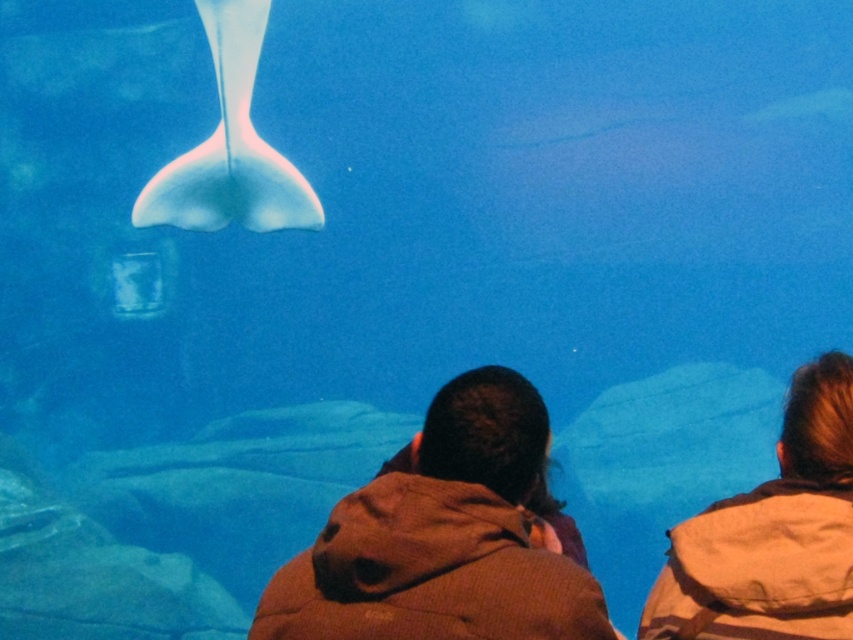
Who is more forward, (x=704, y=566) or (x=309, y=218)?

Positioned in front is point (x=704, y=566).

Can you confirm if brown textured jacket at upper right is positioned to the left of translucent white stingray at upper center?

Incorrect, brown textured jacket at upper right is not on the left side of translucent white stingray at upper center.

Find the location of a particular element. This screenshot has height=640, width=853. brown textured jacket at upper right is located at coordinates (772, 534).

Find the location of `brown textured jacket at upper right`. brown textured jacket at upper right is located at coordinates (772, 534).